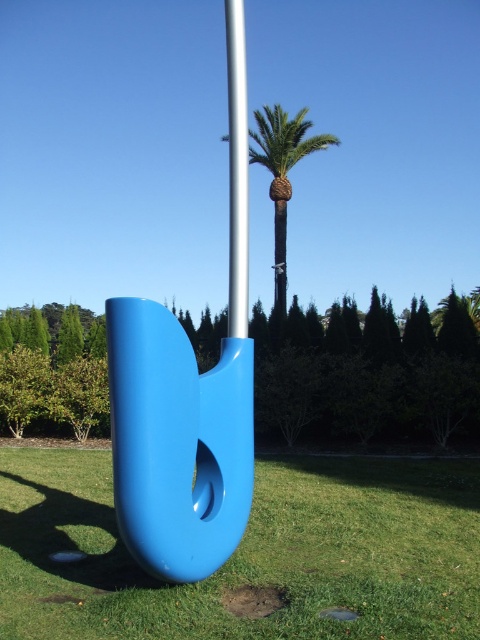
You are a landscape architect planning to place a new statue in the garden. You have two options in front of you, the glossy plastic sculpture at center and the silver metallic pole at center. Which one is shorter?

The glossy plastic sculpture at center is shorter than the silver metallic pole at center.

You are planning to place a small garden bench in this outdoor area. The bench requires a flat surface that is larger than the green leafy palm at center. Can the green grass at lower center accommodate the bench?

The green grass at lower center has a larger size compared to the green leafy palm at center, so yes, the bench can be placed there as it meets the size requirement.

You are planning to place a new bench in the park. The bench requires a shaded area to protect it from direct sunlight. Given the positions of the glossy plastic sculpture at center and the silver metallic pole at center, which object could provide shade for the bench?

The silver metallic pole at center is positioned above the glossy plastic sculpture at center, so placing the bench under the glossy plastic sculpture at center would place it in the shade cast by the silver metallic pole at center.